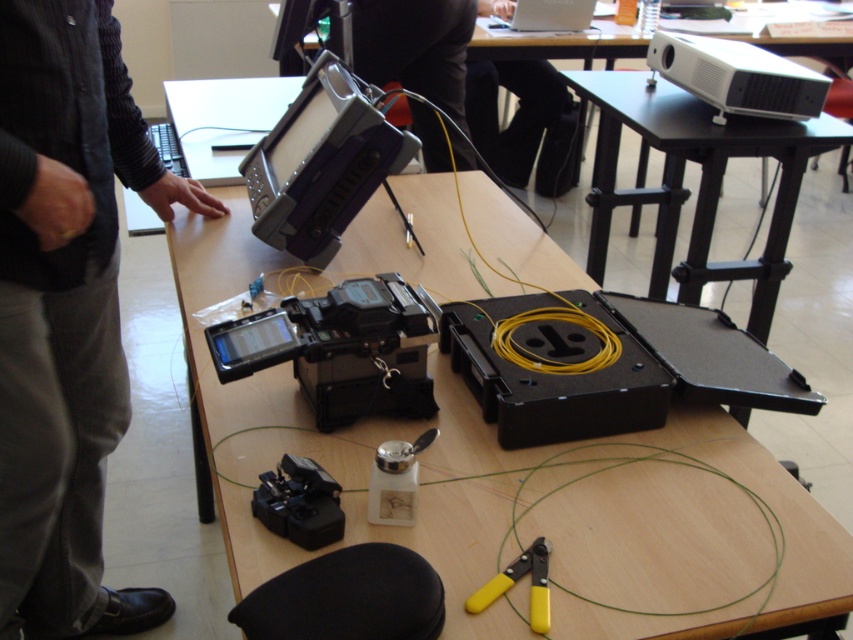
Question: Estimate the real-world distances between objects in this image. Which object is farther from the black plastic video camera at center?

Choices:
 (A) dark gray pants at left
 (B) yellow plastic pliers at lower center
 (C) black fabric pants at upper center
 (D) purple plastic video camera at center

Answer: (C)

Question: Observing the image, what is the correct spatial positioning of black plastic video camera at center in reference to yellow plastic pliers at lower center?

Choices:
 (A) above
 (B) below

Answer: (A)

Question: Is black plastic video camera at center below yellow plastic pliers at lower center?

Choices:
 (A) yes
 (B) no

Answer: (B)

Question: Considering the real-world distances, which object is closest to the purple plastic video camera at center?

Choices:
 (A) wooden table at center
 (B) yellow plastic pliers at lower center

Answer: (A)

Question: Is dark gray pants at left above black plastic video camera at center?

Choices:
 (A) no
 (B) yes

Answer: (A)

Question: Which point is farther from the camera taking this photo?

Choices:
 (A) (73, 328)
 (B) (705, 51)
 (C) (257, 579)
 (D) (531, 545)

Answer: (B)